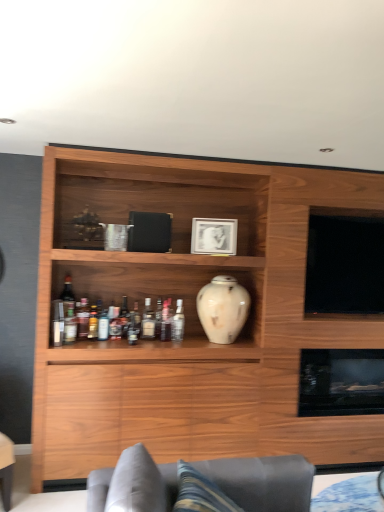
Question: Does black glass fireplace at lower right turn towards translucent glass bottle at middle, the third bottle when ordered from left to right?

Choices:
 (A) yes
 (B) no

Answer: (B)

Question: Is the depth of black glass fireplace at lower right less than that of translucent glass bottle at middle, the third bottle when ordered from left to right?

Choices:
 (A) no
 (B) yes

Answer: (A)

Question: From a real-world perspective, is black glass fireplace at lower right positioned under translucent glass bottle at middle, the third bottle when ordered from left to right, based on gravity?

Choices:
 (A) no
 (B) yes

Answer: (B)

Question: Can you confirm if black glass fireplace at lower right is thinner than translucent glass bottle at middle, the fourth bottle in the right-to-left sequence?

Choices:
 (A) no
 (B) yes

Answer: (A)

Question: Is black glass fireplace at lower right with translucent glass bottle at middle, the fourth bottle in the right-to-left sequence?

Choices:
 (A) no
 (B) yes

Answer: (A)

Question: Is black glass fireplace at lower right positioned beyond the bounds of translucent glass bottle at middle, the third bottle when ordered from left to right?

Choices:
 (A) yes
 (B) no

Answer: (A)

Question: Is translucent glass bottle at middle, arranged as the 3th bottle when viewed from the right, smaller than translucent glass bottle at center, which appears as the 5th bottle when viewed from the right?

Choices:
 (A) no
 (B) yes

Answer: (A)

Question: From the image's perspective, does translucent glass bottle at middle, which appears as the 4th bottle when viewed from the left, appear lower than translucent glass bottle at center, which ranks as the second bottle in left-to-right order?

Choices:
 (A) no
 (B) yes

Answer: (A)

Question: Is translucent glass bottle at middle, which appears as the 4th bottle when viewed from the left, at the right side of translucent glass bottle at center, which ranks as the second bottle in left-to-right order?

Choices:
 (A) no
 (B) yes

Answer: (B)

Question: Is translucent glass bottle at middle, arranged as the 3th bottle when viewed from the right, surrounding translucent glass bottle at center, which ranks as the second bottle in left-to-right order?

Choices:
 (A) yes
 (B) no

Answer: (B)

Question: Considering the relative sizes of translucent glass bottle at middle, arranged as the 3th bottle when viewed from the right, and translucent glass bottle at center, which appears as the 5th bottle when viewed from the right, in the image provided, is translucent glass bottle at middle, arranged as the 3th bottle when viewed from the right, shorter than translucent glass bottle at center, which appears as the 5th bottle when viewed from the right,?

Choices:
 (A) yes
 (B) no

Answer: (A)

Question: Is translucent glass bottle at middle, arranged as the 3th bottle when viewed from the right, at the left side of translucent glass bottle at center, which ranks as the second bottle in left-to-right order?

Choices:
 (A) no
 (B) yes

Answer: (A)

Question: From a real-world perspective, is translucent glass bottle at middle, which appears as the 4th bottle when viewed from the left, located beneath wooden cabinet at center?

Choices:
 (A) no
 (B) yes

Answer: (B)